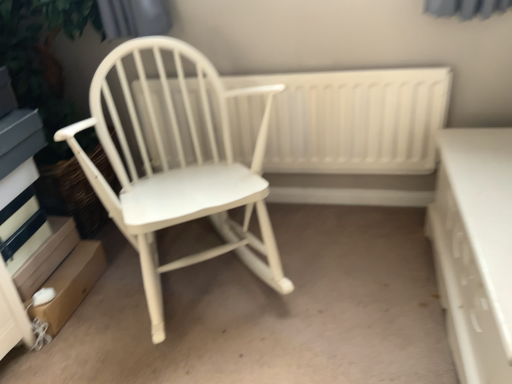
I want to click on white glossy drawer at right, so click(475, 249).

Where is `white wood radiator at center`? The width and height of the screenshot is (512, 384). white wood radiator at center is located at coordinates (354, 120).

I want to click on white wood rocking chair at left, so click(179, 169).

Could you tell me if white wood rocking chair at left is facing white wood radiator at center?

No, white wood rocking chair at left is not oriented towards white wood radiator at center.

What's the angular difference between white wood rocking chair at left and white wood radiator at center's facing directions?

33.4 degrees separate the facing orientations of white wood rocking chair at left and white wood radiator at center.

From the image's perspective, is white wood rocking chair at left beneath white wood radiator at center?

Yes.

From the picture: Between white wood rocking chair at left and white wood radiator at center, which one has larger width?

With larger width is white wood rocking chair at left.

Is white wood radiator at center facing towards white wood rocking chair at left?

Yes, white wood radiator at center is turned towards white wood rocking chair at left.

Is white wood radiator at center positioned behind white wood rocking chair at left?

Yes, white wood radiator at center is behind white wood rocking chair at left.

From the image's perspective, which is above, white wood radiator at center or white wood rocking chair at left?

From the image's view, white wood radiator at center is above.

Considering the positions of objects white glossy drawer at right and white wood rocking chair at left in the image provided, who is in front, white glossy drawer at right or white wood rocking chair at left?

white glossy drawer at right is closer to the camera.

Is white glossy drawer at right inside the boundaries of white wood rocking chair at left, or outside?

white glossy drawer at right lies outside white wood rocking chair at left.

The width and height of the screenshot is (512, 384). I want to click on chair that appears above the white glossy drawer at right (from a real-world perspective), so click(179, 169).

Is white glossy drawer at right not near white wood rocking chair at left?

No, white glossy drawer at right is not far away from white wood rocking chair at left.

Would you say white wood radiator at center is a long distance from white glossy drawer at right?

white wood radiator at center is actually quite close to white glossy drawer at right.

From the image's perspective, is white wood radiator at center above or below white glossy drawer at right?

white wood radiator at center is situated higher than white glossy drawer at right in the image.

What are the coordinates of `radiator behind the white glossy drawer at right` in the screenshot? It's located at (354, 120).

From a real-world perspective, is white glossy drawer at right located beneath white wood radiator at center?

Yes, from a real-world perspective, white glossy drawer at right is below white wood radiator at center.

This screenshot has height=384, width=512. I want to click on table lying in front of the white wood radiator at center, so click(x=475, y=249).

Can you confirm if white glossy drawer at right is taller than white wood radiator at center?

No, white glossy drawer at right is not taller than white wood radiator at center.

Is white glossy drawer at right surrounded by white wood rocking chair at left?

No, white glossy drawer at right is not inside white wood rocking chair at left.

Is white wood rocking chair at left to the right of white glossy drawer at right from the viewer's perspective?

Incorrect, white wood rocking chair at left is not on the right side of white glossy drawer at right.

Does white wood rocking chair at left have a lesser height compared to white glossy drawer at right?

No.

From a real-world perspective, between white wood rocking chair at left and white glossy drawer at right, who is vertically lower?

white glossy drawer at right.

The height and width of the screenshot is (384, 512). I want to click on chair below the white wood radiator at center (from the image's perspective), so click(179, 169).

Locate an element on the screen. This screenshot has width=512, height=384. chair on the left side of white wood radiator at center is located at coordinates [x=179, y=169].

Looking at the image, which one is located closer to white glossy drawer at right, white wood radiator at center or white wood rocking chair at left?

Among the two, white wood radiator at center is located nearer to white glossy drawer at right.

Estimate the real-world distances between objects in this image. Which object is further from white glossy drawer at right, white wood rocking chair at left or white wood radiator at center?

Among the two, white wood rocking chair at left is located further to white glossy drawer at right.

When comparing their distances from white wood radiator at center, does white wood rocking chair at left or white glossy drawer at right seem further?

white glossy drawer at right is positioned further to the anchor white wood radiator at center.

Which object lies nearer to the anchor point white wood radiator at center, white glossy drawer at right or white wood rocking chair at left?

white wood rocking chair at left is positioned closer to the anchor white wood radiator at center.

Based on their spatial positions, is white wood radiator at center or white glossy drawer at right closer to white wood rocking chair at left?

Based on the image, white wood radiator at center appears to be nearer to white wood rocking chair at left.

From the image, which object appears to be farther from white wood rocking chair at left, white glossy drawer at right or white wood radiator at center?

white glossy drawer at right is further to white wood rocking chair at left.

Locate an element on the screen. radiator situated between white wood rocking chair at left and white glossy drawer at right from left to right is located at coordinates (354, 120).